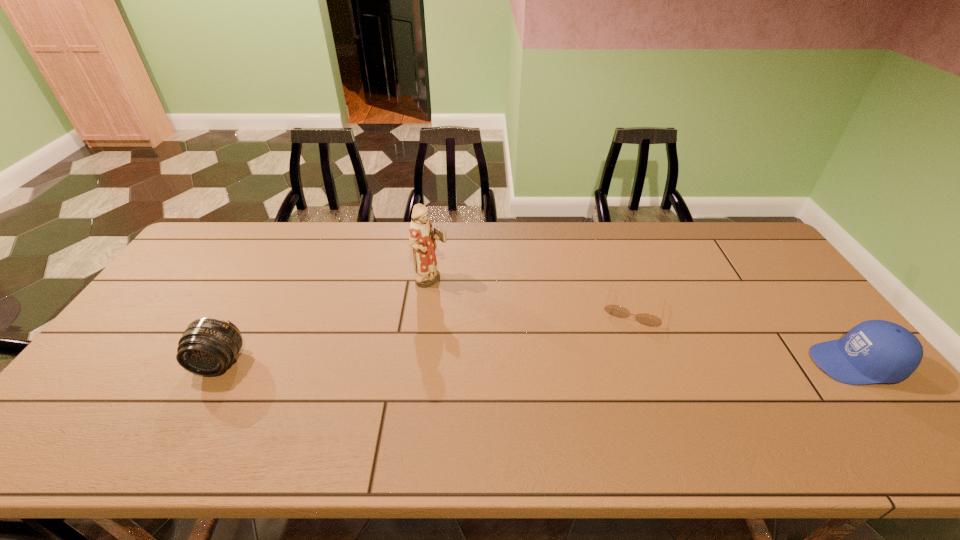
What are the coordinates of `vacant space on the desktop that is between the telephoto lens and the rightmost object and is positioned on the front-facing side of the tallest object` in the screenshot? It's located at (585, 363).

Find the location of a particular element. Image resolution: width=960 pixels, height=540 pixels. free space on the desktop that is between the leftmost object and the cap and is positioned on the face of the sunglasses is located at coordinates (620, 363).